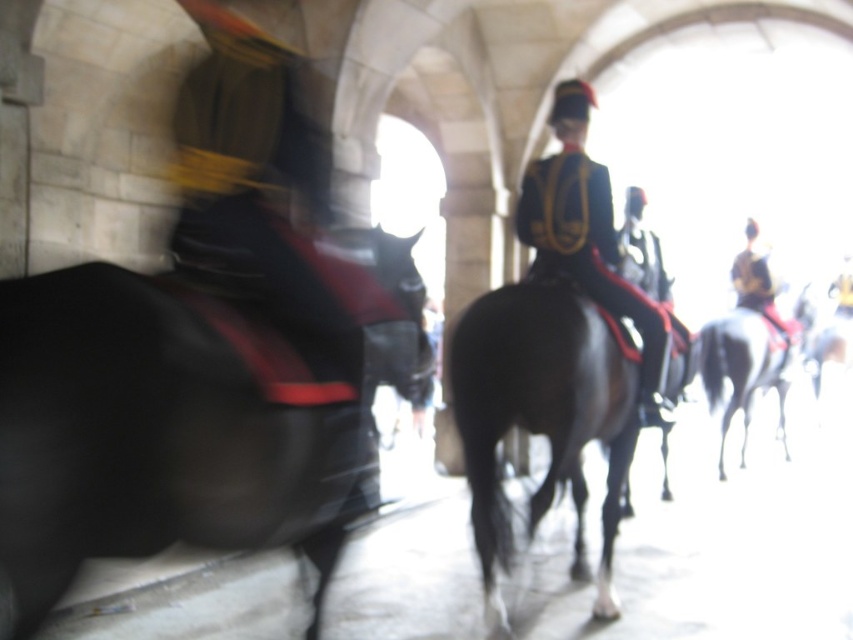
Is shiny gold epaulets at center below white glossy horse at right?

No.

Can you confirm if shiny gold epaulets at center is positioned to the left of white glossy horse at right?

Correct, you'll find shiny gold epaulets at center to the left of white glossy horse at right.

Does point (564, 145) come in front of point (732, 317)?

Yes, it is.

Where is `shiny gold epaulets at center`? The width and height of the screenshot is (853, 640). shiny gold epaulets at center is located at coordinates (587, 244).

Is black glossy horse at left closer to the viewer compared to shiny gold helmet at right?

Yes, black glossy horse at left is in front of shiny gold helmet at right.

Between point (135, 432) and point (741, 294), which one is positioned behind?

The point (741, 294) is behind.

At what (x,y) coordinates should I click in order to perform the action: click on black glossy horse at left. Please return your answer as a coordinate pair (x, y). The image size is (853, 640). Looking at the image, I should click on (183, 420).

Can you confirm if shiny gold epaulets at center is smaller than white glossy horse at center?

Yes, shiny gold epaulets at center is smaller than white glossy horse at center.

Find the location of `shiny gold epaulets at center`. shiny gold epaulets at center is located at coordinates (587, 244).